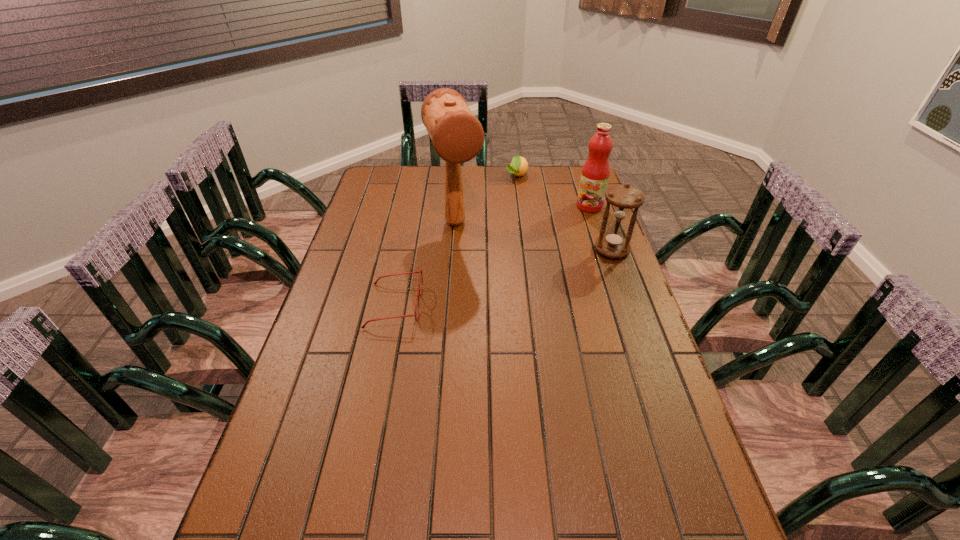
Identify the location of vacant space on the desktop that is between the nearest object and the hourglass and is positioned with leaves positioned above the third object from right to left. The image size is (960, 540). (492, 281).

You are a GUI agent. You are given a task and a screenshot of the screen. Output one action in this format:
    pyautogui.click(x=<x>, y=<y>)
    Task: Click on the free space on the desktop that is between the nearest object and the third tallest object and is positioned on the front label of the fruit juice
    The image size is (960, 540).
    Given the screenshot: What is the action you would take?
    pyautogui.click(x=513, y=275)

At what (x,y) coordinates should I click in order to perform the action: click on vacant space on the desktop that is between the spectacles and the hourglass and is positioned on the strike surface of the tallest object. Please return your answer as a coordinate pair (x, y). Looking at the image, I should click on (480, 284).